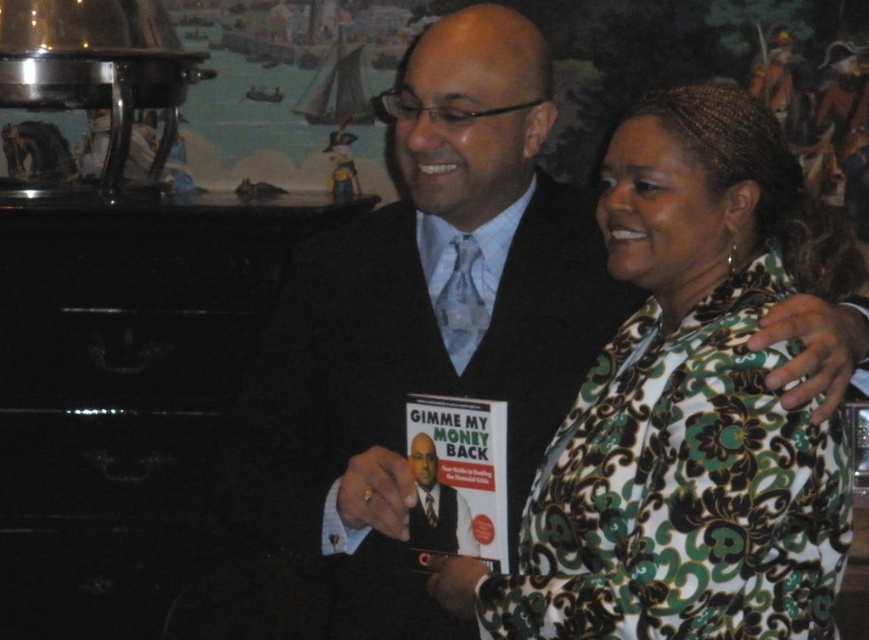
You are at a social event and want to hand a small note to the person wearing the matte black suit at center without interrupting their conversation. Since the matte black book at center is blocking your view, can you still see their face?

The matte black suit at center is taller than the matte black book at center, so yes, you can still see their face above the book.

You are a photographer at a social event. You want to take a photo that focuses on the matte black book at center while keeping the green floral jacket at center somewhat visible in the background. Is the current positioning suitable for this?

The green floral jacket at center is closer to the viewer than matte black book at center, so the current positioning is not suitable. The matte black book at center would be behind the green floral jacket at center and might be less visible in the photo.

You are a photographer adjusting your camera settings to capture a clear photo of two points in the image. The points are labeled as point (x=518, y=467) and point (x=413, y=440). Which point is closer to your camera lens?

Point (x=518, y=467) is further to the camera than point (x=413, y=440), so the point closer to the camera lens is point (x=413, y=440).